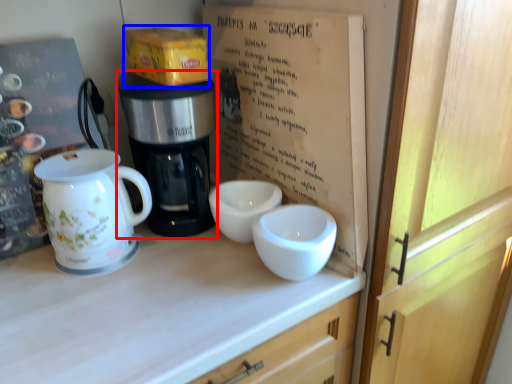
Question: Among these objects, which one is farthest to the camera, coffee maker (highlighted by a red box) or cardboard box (highlighted by a blue box)?

Choices:
 (A) coffee maker
 (B) cardboard box

Answer: (B)